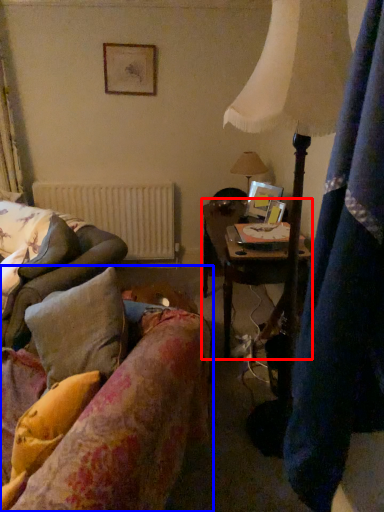
Question: Which of the following is the farthest to the observer, table (highlighted by a red box) or studio couch (highlighted by a blue box)?

Choices:
 (A) table
 (B) studio couch

Answer: (A)